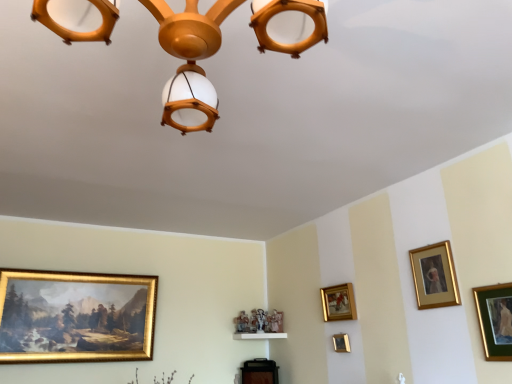
This screenshot has height=384, width=512. What do you see at coordinates (190, 61) in the screenshot?
I see `wooden chandelier at upper center` at bounding box center [190, 61].

The height and width of the screenshot is (384, 512). What do you see at coordinates (434, 276) in the screenshot?
I see `gold/golden picture frame at upper right, placed as the fourth picture frame when sorted from left to right` at bounding box center [434, 276].

The width and height of the screenshot is (512, 384). What do you see at coordinates (341, 343) in the screenshot?
I see `gold/gilded picture frame at lower center, marked as the 5th picture frame in a front-to-back arrangement` at bounding box center [341, 343].

In order to click on gold/gilded picture frame at lower left, which is the 3th picture frame from front to back in this screenshot , I will do `click(76, 316)`.

Locate an element on the screen. The image size is (512, 384). green matte picture frame at right, which appears as the first picture frame when viewed from the front is located at coordinates (495, 320).

Considering the positions of objects wooden chandelier at upper center and gold/gilded picture frame at lower left, the 1th picture frame positioned from the left, in the image provided, who is more to the right, wooden chandelier at upper center or gold/gilded picture frame at lower left, the 1th picture frame positioned from the left,?

Positioned to the right is wooden chandelier at upper center.

From the picture: Which is behind, wooden chandelier at upper center or gold/gilded picture frame at lower left, which is the 3th picture frame from front to back?

gold/gilded picture frame at lower left, which is the 3th picture frame from front to back, is more distant.

Is wooden chandelier at upper center oriented towards gold/gilded picture frame at lower left, which is the 3th picture frame from front to back?

No, wooden chandelier at upper center is not aimed at gold/gilded picture frame at lower left, which is the 3th picture frame from front to back.

Looking at their sizes, would you say gold/gilded picture frame at lower left, the 3th picture frame in the back-to-front sequence, is wider or thinner than gold/gilded picture frame at center-right, which is the 2th picture frame from left to right?

gold/gilded picture frame at lower left, the 3th picture frame in the back-to-front sequence, is thinner than gold/gilded picture frame at center-right, which is the 2th picture frame from left to right.

From a real-world perspective, is gold/gilded picture frame at lower left, which is the 5th picture frame in right-to-left order, physically located above or below gold/gilded picture frame at center-right, arranged as the 4th picture frame when viewed from the front?

gold/gilded picture frame at lower left, which is the 5th picture frame in right-to-left order, is situated lower than gold/gilded picture frame at center-right, arranged as the 4th picture frame when viewed from the front, in the real world.

Does gold/gilded picture frame at lower left, the 3th picture frame in the back-to-front sequence, have a greater height compared to gold/gilded picture frame at center-right, which is the 2th picture frame from left to right?

Indeed, gold/gilded picture frame at lower left, the 3th picture frame in the back-to-front sequence, has a greater height compared to gold/gilded picture frame at center-right, which is the 2th picture frame from left to right.

Where is `the 1st picture frame counting from the right side of the gold/gilded picture frame at lower left, which is the 5th picture frame in right-to-left order`? This screenshot has height=384, width=512. the 1st picture frame counting from the right side of the gold/gilded picture frame at lower left, which is the 5th picture frame in right-to-left order is located at coordinates (338, 302).

Considering the sizes of objects gold/gilded picture frame at center-right, the second picture frame in the back-to-front sequence, and gold/gilded picture frame at lower left, which is the 5th picture frame in right-to-left order, in the image provided, who is bigger, gold/gilded picture frame at center-right, the second picture frame in the back-to-front sequence, or gold/gilded picture frame at lower left, which is the 5th picture frame in right-to-left order,?

Bigger between the two is gold/gilded picture frame at lower left, which is the 5th picture frame in right-to-left order.

Considering the relative sizes of gold/gilded picture frame at center-right, which is the 2th picture frame from left to right, and gold/gilded picture frame at lower left, which is the 5th picture frame in right-to-left order, in the image provided, is gold/gilded picture frame at center-right, which is the 2th picture frame from left to right, thinner than gold/gilded picture frame at lower left, which is the 5th picture frame in right-to-left order,?

No.

Which object is positioned more to the right, gold/gilded picture frame at center-right, arranged as the 4th picture frame when viewed from the front, or gold/gilded picture frame at lower left, which is the 5th picture frame in right-to-left order?

gold/gilded picture frame at center-right, arranged as the 4th picture frame when viewed from the front, is more to the right.

Based on the photo, from a real-world perspective, which object rests below the other?

gold/gilded picture frame at lower left, which is the 3th picture frame from front to back, is physically lower.

Is green matte picture frame at right, the fifth picture frame from the left, surrounded by wooden chandelier at upper center?

No, green matte picture frame at right, the fifth picture frame from the left, is not a part of wooden chandelier at upper center.

Between point (173, 95) and point (490, 317), which one is positioned in front?

The point (173, 95) is in front.

From a real-world perspective, relative to green matte picture frame at right, the fifth picture frame from the left, is wooden chandelier at upper center vertically above or below?

wooden chandelier at upper center is above green matte picture frame at right, the fifth picture frame from the left.

Where is `lamp located above the green matte picture frame at right, which appears as the first picture frame when viewed from the front (from the image's perspective)`? This screenshot has width=512, height=384. lamp located above the green matte picture frame at right, which appears as the first picture frame when viewed from the front (from the image's perspective) is located at coordinates (190, 61).

Where is `the 2nd picture frame behind the gold/golden picture frame at upper right, which ranks as the fourth picture frame in back-to-front order`? The height and width of the screenshot is (384, 512). the 2nd picture frame behind the gold/golden picture frame at upper right, which ranks as the fourth picture frame in back-to-front order is located at coordinates (338, 302).

Is point (346, 300) positioned after point (449, 248)?

That is True.

Does gold/gilded picture frame at center-right, positioned as the 4th picture frame in right-to-left order, come in front of gold/golden picture frame at upper right, placed as the fourth picture frame when sorted from left to right?

No, it is not.

Does gold/gilded picture frame at center-right, arranged as the 4th picture frame when viewed from the front, have a greater height compared to gold/golden picture frame at upper right, placed as the fourth picture frame when sorted from left to right?

Incorrect, the height of gold/gilded picture frame at center-right, arranged as the 4th picture frame when viewed from the front, is not larger of that of gold/golden picture frame at upper right, placed as the fourth picture frame when sorted from left to right.

Is gold/gilded picture frame at lower center, positioned as the 3th picture frame in left-to-right order, outside of green matte picture frame at right, which appears as the first picture frame when viewed from the front?

gold/gilded picture frame at lower center, positioned as the 3th picture frame in left-to-right order, is positioned outside green matte picture frame at right, which appears as the first picture frame when viewed from the front.

Who is smaller, gold/gilded picture frame at lower center, positioned as the 3th picture frame in left-to-right order, or green matte picture frame at right, which appears as the first picture frame when viewed from the front?

With smaller size is gold/gilded picture frame at lower center, positioned as the 3th picture frame in left-to-right order.

Is there a large distance between gold/gilded picture frame at lower center, positioned as the 3th picture frame in left-to-right order, and green matte picture frame at right, the fifth picture frame from the left?

gold/gilded picture frame at lower center, positioned as the 3th picture frame in left-to-right order, is positioned a significant distance from green matte picture frame at right, the fifth picture frame from the left.

From the image's perspective, between gold/golden picture frame at upper right, which ranks as the fourth picture frame in back-to-front order, and gold/gilded picture frame at lower center, placed as the third picture frame when sorted from right to left, who is located below?

From the image's view, gold/gilded picture frame at lower center, placed as the third picture frame when sorted from right to left, is below.

Considering the sizes of objects gold/golden picture frame at upper right, placed as the fourth picture frame when sorted from left to right, and gold/gilded picture frame at lower center, placed as the third picture frame when sorted from right to left, in the image provided, who is bigger, gold/golden picture frame at upper right, placed as the fourth picture frame when sorted from left to right, or gold/gilded picture frame at lower center, placed as the third picture frame when sorted from right to left,?

gold/golden picture frame at upper right, placed as the fourth picture frame when sorted from left to right, is bigger.

Find the location of a particular element. picture frame that is the 1st one when counting rightward from the gold/gilded picture frame at lower center, placed as the third picture frame when sorted from right to left is located at coordinates (434, 276).

Image resolution: width=512 pixels, height=384 pixels. In order to click on lamp that appears in front of the gold/gilded picture frame at lower left, the 3th picture frame in the back-to-front sequence in this screenshot , I will do `click(190, 61)`.

Starting from the gold/gilded picture frame at lower left, which is the 5th picture frame in right-to-left order, which picture frame is the 1st one behind? Please provide its 2D coordinates.

[(338, 302)]

From the image, which object appears to be farther from green matte picture frame at right, which appears as the first picture frame when viewed from the front, gold/gilded picture frame at center-right, positioned as the 4th picture frame in right-to-left order, or gold/golden picture frame at upper right, which ranks as the fourth picture frame in back-to-front order?

Answer: Based on the image, gold/gilded picture frame at center-right, positioned as the 4th picture frame in right-to-left order, appears to be further to green matte picture frame at right, which appears as the first picture frame when viewed from the front.

Considering their positions, is gold/gilded picture frame at lower left, which is the 5th picture frame in right-to-left order, positioned closer to gold/golden picture frame at upper right, which ranks as the fourth picture frame in back-to-front order, than wooden chandelier at upper center?

wooden chandelier at upper center lies closer to gold/golden picture frame at upper right, which ranks as the fourth picture frame in back-to-front order, than the other object.

Based on their spatial positions, is gold/golden picture frame at upper right, which appears as the 2th picture frame when viewed from the front, or gold/gilded picture frame at lower center, positioned as the 3th picture frame in left-to-right order, further from gold/gilded picture frame at lower left, the 1th picture frame positioned from the left?

gold/golden picture frame at upper right, which appears as the 2th picture frame when viewed from the front, is further to gold/gilded picture frame at lower left, the 1th picture frame positioned from the left.

Looking at the image, which one is located further to wooden chandelier at upper center, gold/gilded picture frame at lower left, the 3th picture frame in the back-to-front sequence, or gold/gilded picture frame at lower center, positioned as the 3th picture frame in left-to-right order?

gold/gilded picture frame at lower left, the 3th picture frame in the back-to-front sequence, is positioned further to the anchor wooden chandelier at upper center.

Which object lies nearer to the anchor point gold/gilded picture frame at center-right, the second picture frame in the back-to-front sequence, gold/gilded picture frame at lower center, positioned as the 3th picture frame in left-to-right order, or gold/golden picture frame at upper right, which ranks as the fourth picture frame in back-to-front order?

gold/gilded picture frame at lower center, positioned as the 3th picture frame in left-to-right order, is positioned closer to the anchor gold/gilded picture frame at center-right, the second picture frame in the back-to-front sequence.

When comparing their distances from gold/gilded picture frame at center-right, which is the 2th picture frame from left to right, does gold/gilded picture frame at lower center, marked as the 5th picture frame in a front-to-back arrangement, or wooden chandelier at upper center seem further?

wooden chandelier at upper center is further to gold/gilded picture frame at center-right, which is the 2th picture frame from left to right.

Which object lies nearer to the anchor point gold/golden picture frame at upper right, which ranks as the fourth picture frame in back-to-front order, gold/gilded picture frame at lower left, which is the 5th picture frame in right-to-left order, or gold/gilded picture frame at lower center, positioned as the 3th picture frame in left-to-right order?

Based on the image, gold/gilded picture frame at lower center, positioned as the 3th picture frame in left-to-right order, appears to be nearer to gold/golden picture frame at upper right, which ranks as the fourth picture frame in back-to-front order.

Which object lies further to the anchor point green matte picture frame at right, which appears as the first picture frame when viewed from the front, gold/gilded picture frame at center-right, which is the 2th picture frame from left to right, or gold/gilded picture frame at lower left, the 1th picture frame positioned from the left?

gold/gilded picture frame at lower left, the 1th picture frame positioned from the left.

This screenshot has width=512, height=384. In order to click on lamp between gold/gilded picture frame at lower left, which is the 5th picture frame in right-to-left order, and green matte picture frame at right, which is the fifth picture frame in back-to-front order, in the horizontal direction in this screenshot , I will do `click(190, 61)`.

Locate an element on the screen. Image resolution: width=512 pixels, height=384 pixels. picture frame located between wooden chandelier at upper center and gold/golden picture frame at upper right, which is counted as the second picture frame, starting from the right, in the depth direction is located at coordinates [495, 320].

Locate an element on the screen. picture frame between gold/gilded picture frame at lower left, the 3th picture frame in the back-to-front sequence, and gold/gilded picture frame at lower center, placed as the third picture frame when sorted from right to left, from left to right is located at coordinates (338, 302).